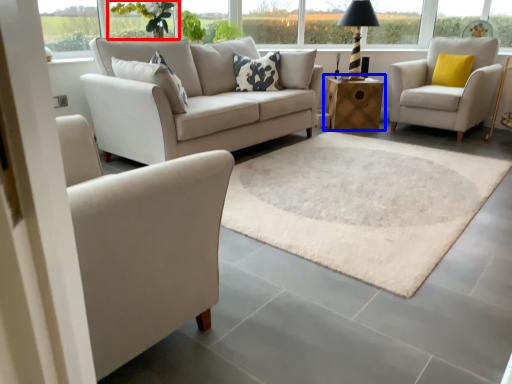
Question: Which object appears farthest to the camera in this image, flower (highlighted by a red box) or table (highlighted by a blue box)?

Choices:
 (A) flower
 (B) table

Answer: (B)